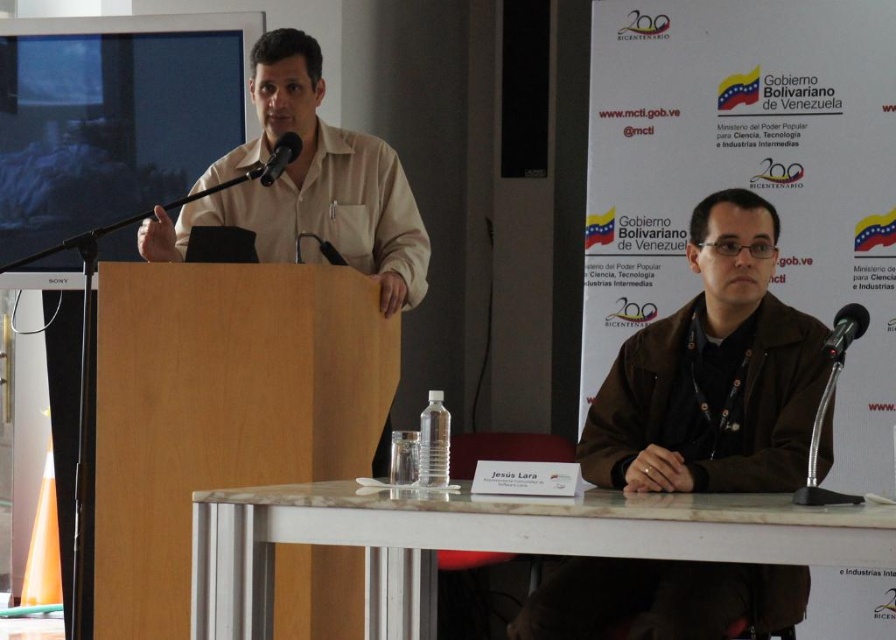
Question: Based on their relative distances, which object is nearer to the brown leather jacket at center?

Choices:
 (A) beige cotton shirt at center
 (B) black metallic microphone at right
 (C) metallic black microphone at upper center

Answer: (B)

Question: Which object appears farthest from the camera in this image?

Choices:
 (A) white marble table at lower center
 (B) brown leather jacket at center
 (C) black metallic microphone at right
 (D) beige cotton shirt at center

Answer: (D)

Question: Which object is closer to the camera taking this photo?

Choices:
 (A) beige cotton shirt at center
 (B) metallic black microphone at upper center
 (C) brown leather jacket at center
 (D) white marble table at lower center

Answer: (D)

Question: Does beige cotton shirt at center have a greater width compared to black metallic microphone at right?

Choices:
 (A) yes
 (B) no

Answer: (A)

Question: Is beige cotton shirt at center smaller than metallic black microphone at upper center?

Choices:
 (A) yes
 (B) no

Answer: (B)

Question: Does black metallic microphone at right have a larger size compared to metallic black microphone at upper center?

Choices:
 (A) yes
 (B) no

Answer: (B)